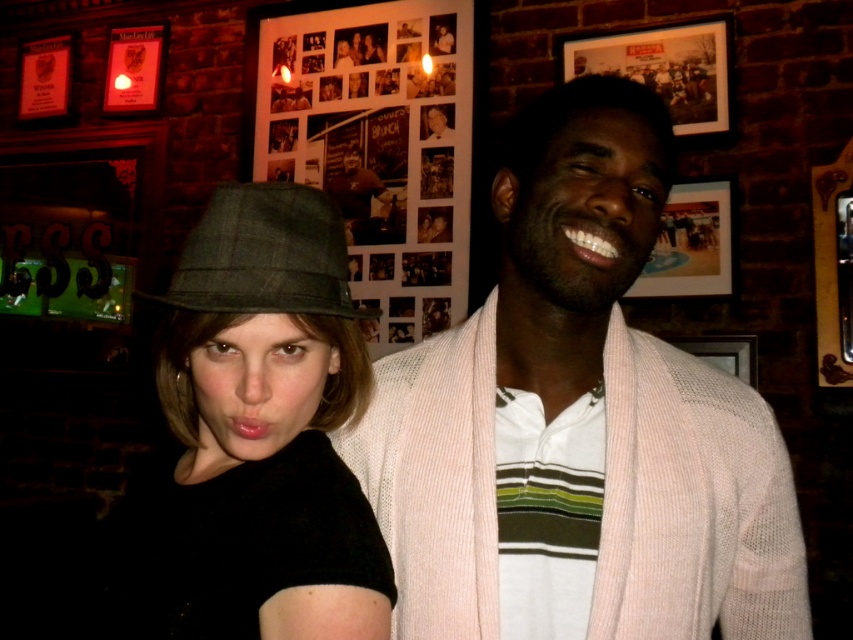
Question: Does pink knit cardigan at center lie in front of plaid fabric hat at center?

Choices:
 (A) yes
 (B) no

Answer: (B)

Question: Which point appears farthest from the camera in this image?

Choices:
 (A) (712, 410)
 (B) (328, 211)

Answer: (A)

Question: Among these objects, which one is nearest to the camera?

Choices:
 (A) green plaid fedora at left
 (B) smooth skin face at center
 (C) plaid fabric hat at center

Answer: (A)

Question: Which point appears closest to the camera in this image?

Choices:
 (A) (305, 284)
 (B) (206, 611)
 (C) (427, 106)

Answer: (A)

Question: In this image, where is pink knit cardigan at center located relative to plaid fabric hat at center?

Choices:
 (A) above
 (B) below

Answer: (A)

Question: Does pink knit cardigan at center appear on the left side of smooth skin face at center?

Choices:
 (A) yes
 (B) no

Answer: (B)